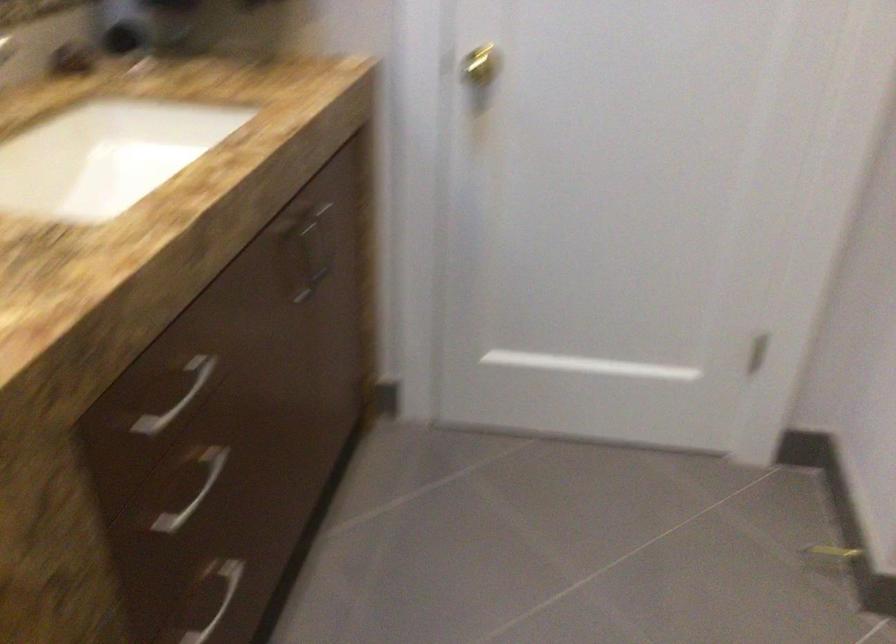
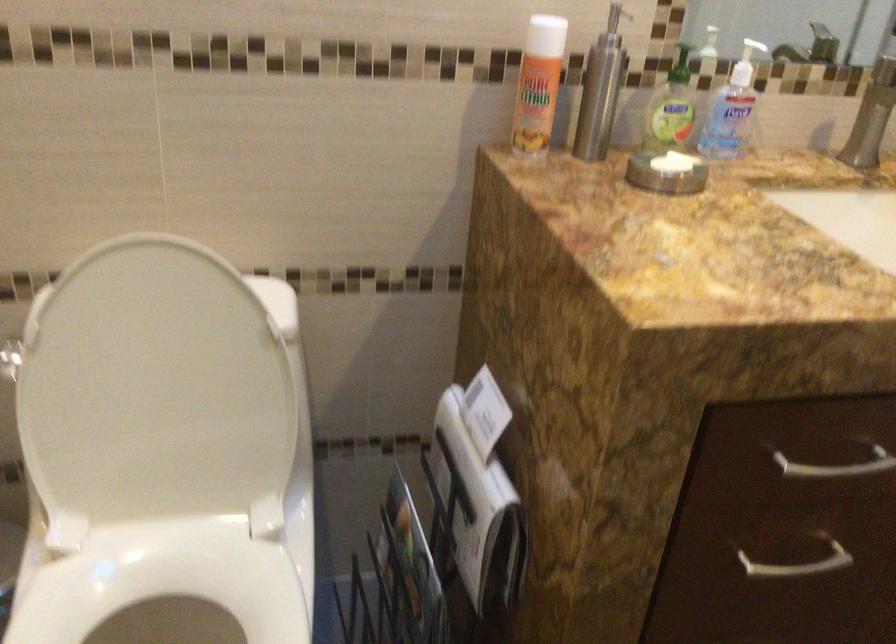
In the second image, find the point that corresponds to point (195, 489) in the first image.

(797, 565)